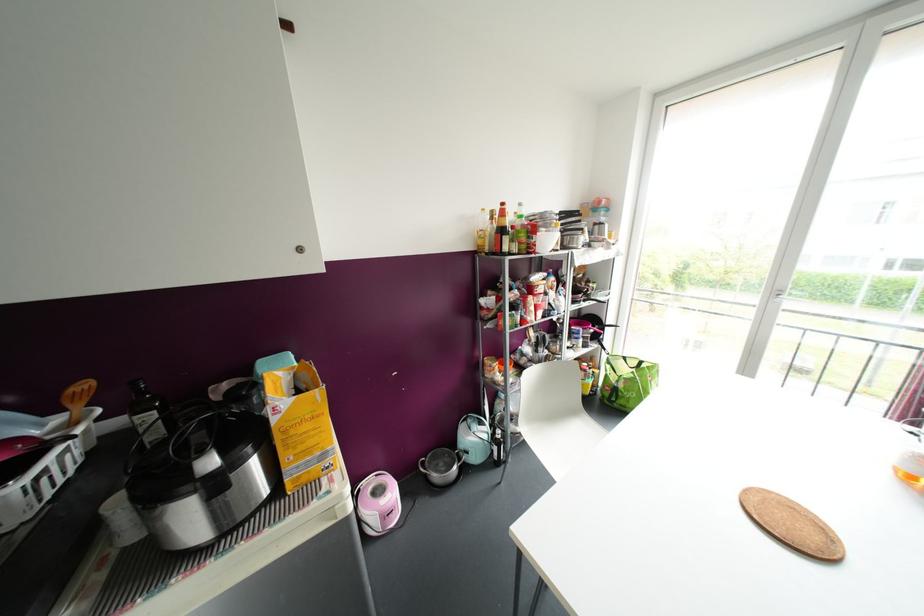
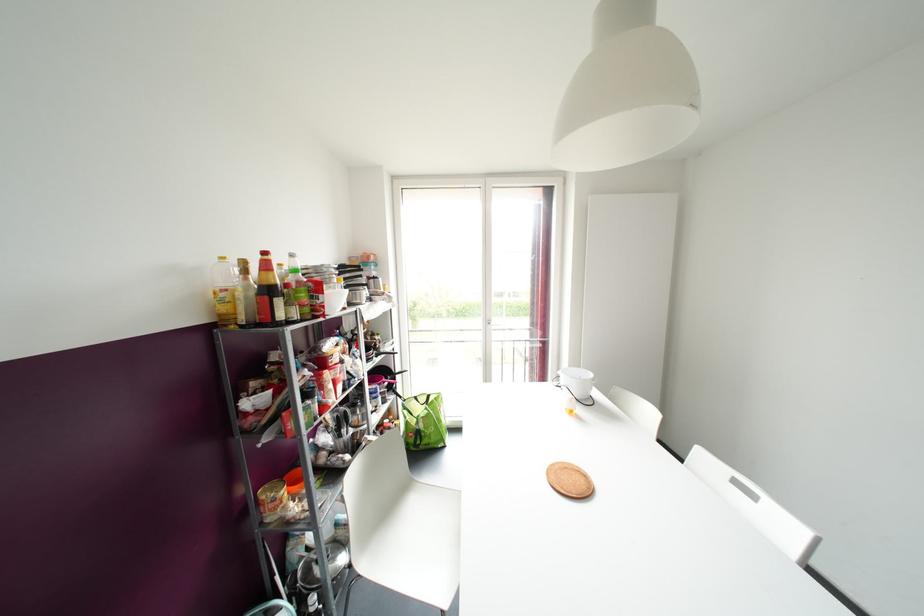
Question: The first image is from the beginning of the video and the second image is from the end. How did the camera likely rotate when shooting the video?

Choices:
 (A) Left
 (B) Right
 (C) Up
 (D) Down

Answer: (B)